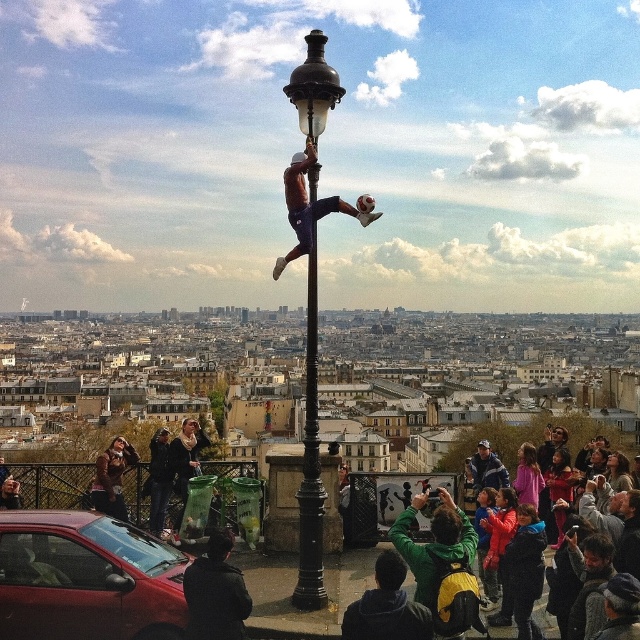
Can you confirm if black polished metal street light at center is thinner than smooth brown leather jacket at lower right?

Indeed, black polished metal street light at center has a lesser width compared to smooth brown leather jacket at lower right.

Can you confirm if black polished metal street light at center is taller than smooth brown leather jacket at lower right?

Yes, black polished metal street light at center is taller than smooth brown leather jacket at lower right.

Is point (312, 88) positioned before point (538, 449)?

Yes.

Image resolution: width=640 pixels, height=640 pixels. I want to click on black polished metal street light at center, so click(310, 460).

Does black polished metal street light at center have a lesser width compared to blue denim jacket at center?

Yes, black polished metal street light at center is thinner than blue denim jacket at center.

Does black polished metal street light at center have a smaller size compared to blue denim jacket at center?

No, black polished metal street light at center is not smaller than blue denim jacket at center.

Locate an element on the screen. The height and width of the screenshot is (640, 640). black polished metal street light at center is located at coordinates (310, 460).

Can you confirm if blue denim jacket at center is positioned above smooth brown leather jacket at lower right?

No, blue denim jacket at center is not above smooth brown leather jacket at lower right.

This screenshot has width=640, height=640. Find the location of `blue denim jacket at center`. blue denim jacket at center is located at coordinates (486, 468).